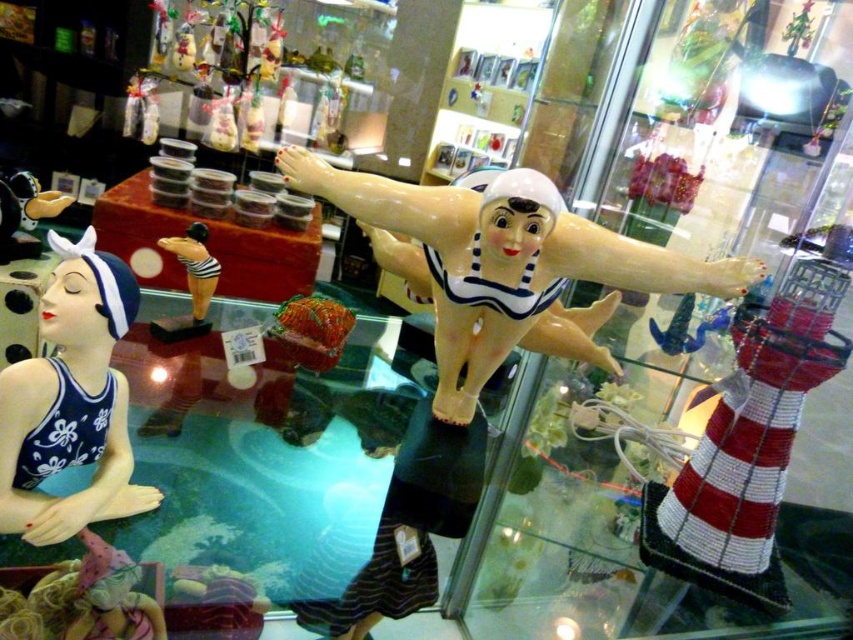
In the scene shown: You are a shop assistant arranging items in the display case. You need to place a new figurine that requires at least as much space as the blue glossy swimsuit at left. Can the space currently occupied by the matte black swimsuit at center accommodate it?

The blue glossy swimsuit at left is wider than the matte black swimsuit at center. Therefore, the space currently occupied by the matte black swimsuit at center is not wide enough to accommodate the new figurine requiring the same or more space as the blue glossy swimsuit at left.

Please provide the 2D coordinates of the matte black rubber duck at upper left in the display case.

The 2D coordinates of the matte black rubber duck at upper left are at point (24, 212).